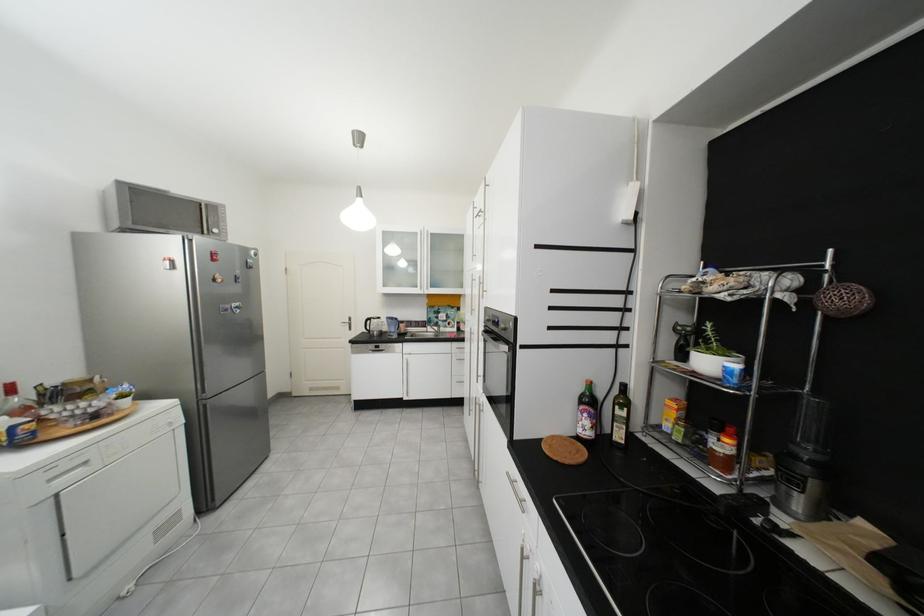
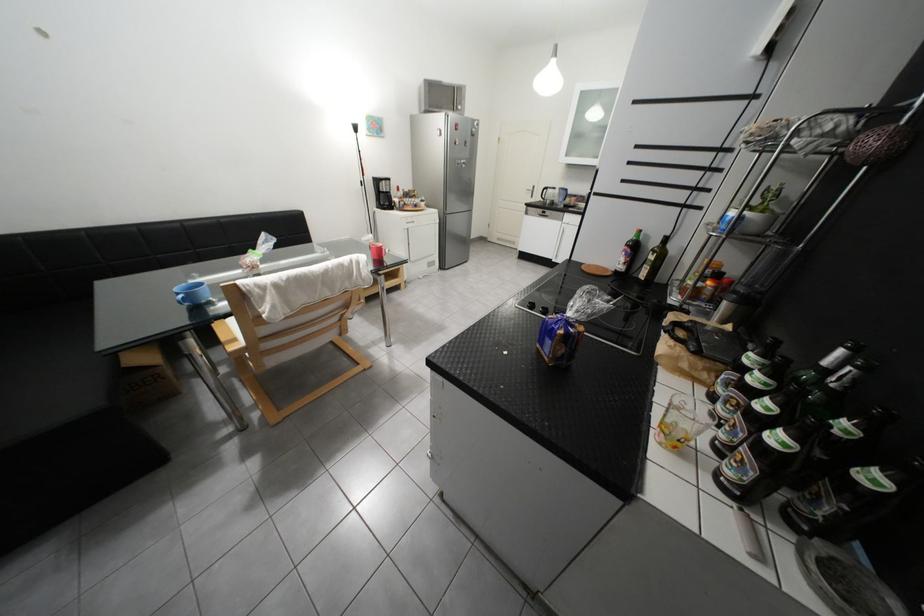
Find the pixel in the second image that matches the point at 178,246 in the first image.

(451, 121)